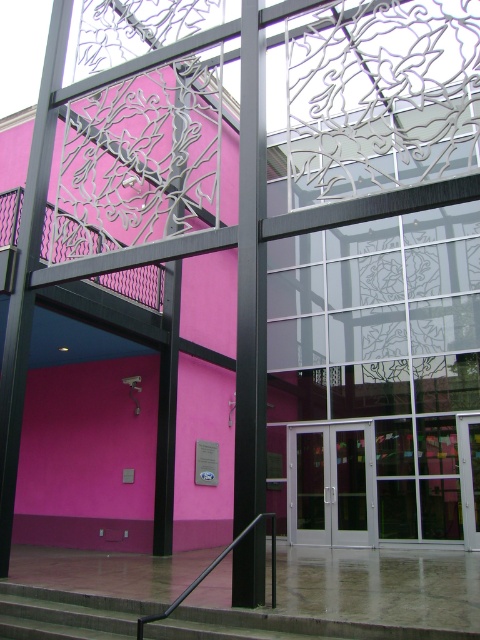
You are a delivery person trying to enter the building through the white glass door at center. The delivery cart you are pushing is 1.2 meters tall. Can you safely pass through the entrance without hitting your head on the concrete stairs at lower center?

The concrete stairs at lower center is shorter than the white glass door at center. Since the stairs are shorter, the clearance under the door is sufficient. The delivery cart is 1.2 meters tall, so as long as the door height is more than 1.2 meters, it should be safe. However, the description only states the stairs are shorter than the door, not the door height. Without knowing the door height, we cannot confirm safety. Please check the door height before proceeding.